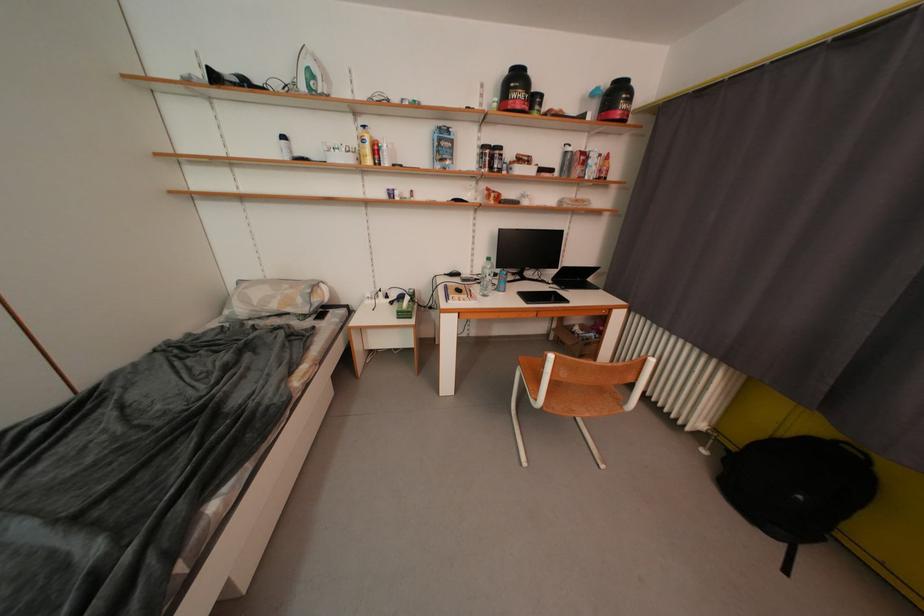
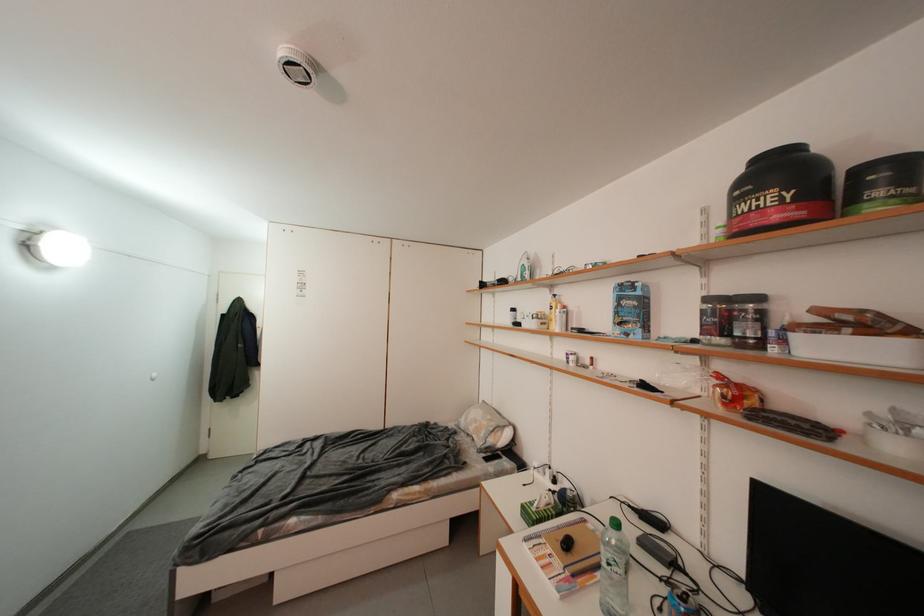
The point at (508, 151) is marked in the first image. Where is the corresponding point in the second image?

(766, 301)